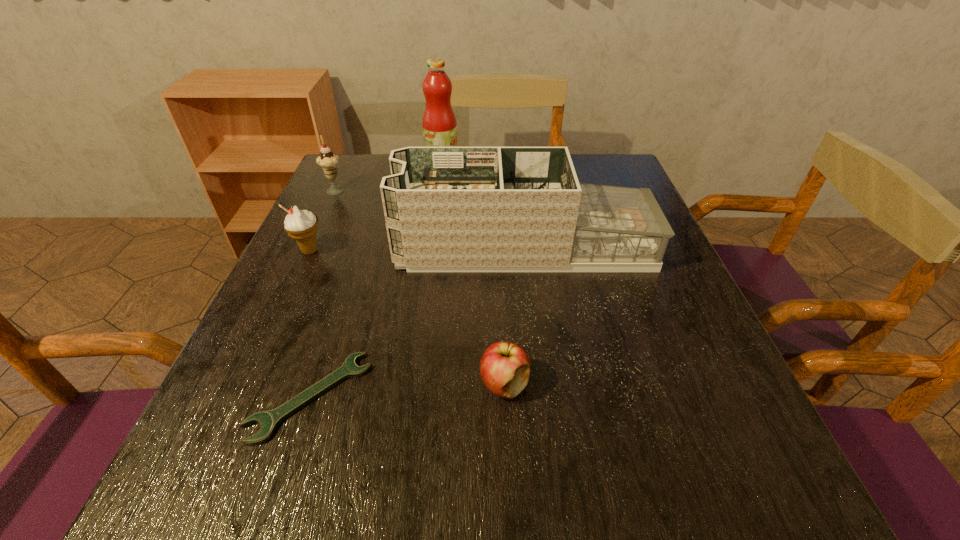
At what (x,y) coordinates should I click in order to perform the action: click on object at the right edge. Please return your answer as a coordinate pair (x, y). The image size is (960, 540). Looking at the image, I should click on (x=447, y=209).

Locate an element on the screen. object present at the far left corner is located at coordinates (327, 160).

The image size is (960, 540). Identify the location of vacant space at the left edge of the desktop. pyautogui.click(x=301, y=337).

Identify the location of vacant region at the far left corner of the desktop. (370, 165).

The image size is (960, 540). In order to click on free space at the near left corner in this screenshot , I will do `click(260, 486)`.

Image resolution: width=960 pixels, height=540 pixels. I want to click on free space at the far right corner of the desktop, so click(611, 154).

Identify the location of vacant space that's between the shortest object and the fruit juice. This screenshot has width=960, height=540. (376, 282).

You are a GUI agent. You are given a task and a screenshot of the screen. Output one action in this format:
    pyautogui.click(x=<x>, y=<y>)
    Task: Click on the free space between the second shortest object and the fifth shortest object
    Image resolution: width=960 pixels, height=540 pixels.
    Given the screenshot: What is the action you would take?
    pyautogui.click(x=515, y=315)

Where is `vacant space that is in between the third shortest object and the fifth tallest object`? This screenshot has width=960, height=540. vacant space that is in between the third shortest object and the fifth tallest object is located at coordinates (407, 318).

Image resolution: width=960 pixels, height=540 pixels. I want to click on free spot between the nearer icecream and the apple, so (x=407, y=318).